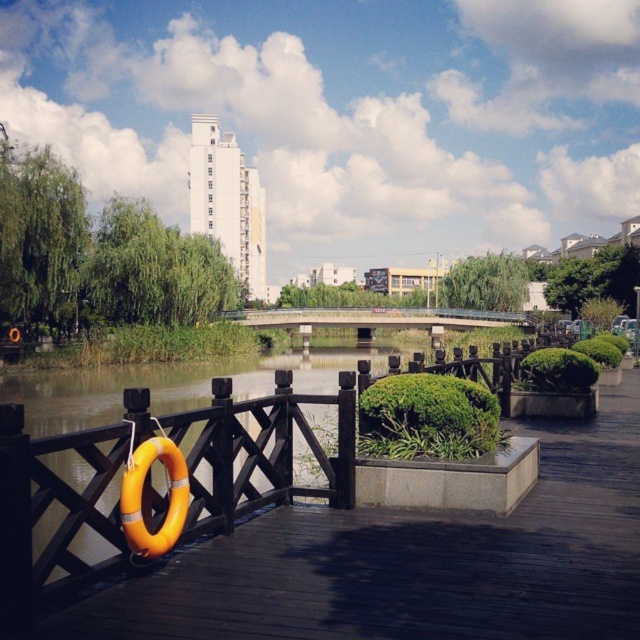
You are standing on the wooden walkway and want to place a new bench exactly halfway between the orange rubber ring at left and the weeping willow trees on the left side of the water. Can you determine the coordinates where the bench should be placed?

The orange rubber ring at left is located at point (412, 561). However, the exact coordinates of the weeping willow trees are not provided in the Objects Description. Therefore, it is not possible to calculate the halfway point between them.

You are a park visitor standing on the wooden walkway. You see the orange rubber ring at left and the concrete bridge at center. Which object is closer to your left side?

The orange rubber ring at left is closer to your left side because it is positioned to the left of the concrete bridge at center.

You are standing at the starting point of the wooden walkway and want to reach the point marked as point (584, 557). Is this point closer to you than the point marked as point (480, 324)?

Point (584, 557) is in front of point (480, 324), so yes, it is closer to you.